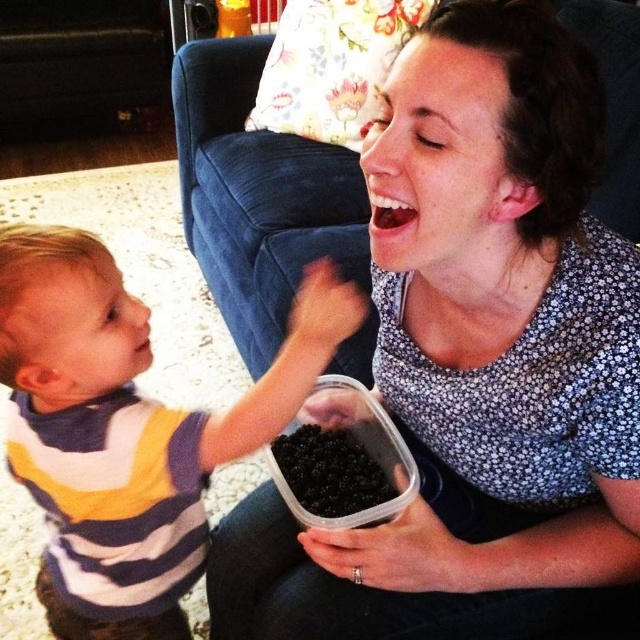
Question: Which point is farther from the camera taking this photo?

Choices:
 (A) (314, 378)
 (B) (592, 67)
 (C) (326, 445)

Answer: (C)

Question: Is striped cotton shirt at left bigger than black matte container at center?

Choices:
 (A) yes
 (B) no

Answer: (A)

Question: Does floral-patterned shirt at center appear on the right side of striped cotton shirt at left?

Choices:
 (A) yes
 (B) no

Answer: (A)

Question: Among these points, which one is nearest to the camera?

Choices:
 (A) (520, 132)
 (B) (276, 442)
 (C) (113, 259)

Answer: (A)

Question: Is floral-patterned shirt at center behind striped cotton shirt at left?

Choices:
 (A) yes
 (B) no

Answer: (B)

Question: Which point is farther from the camera taking this photo?

Choices:
 (A) (275, 454)
 (B) (589, 160)

Answer: (A)